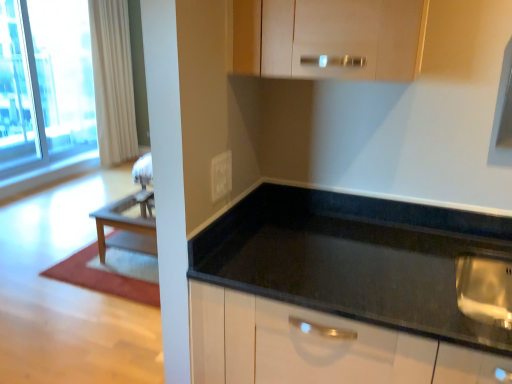
What is the approximate width of black granite countertop at center?

The width of black granite countertop at center is 26.19 inches.

Where is `matte wood cabinet at upper center`? This screenshot has height=384, width=512. matte wood cabinet at upper center is located at coordinates (343, 37).

Can you confirm if transparent glass window at upper left is smaller than white glossy electric outlet at center?

Actually, transparent glass window at upper left might be larger than white glossy electric outlet at center.

Looking at their sizes, would you say transparent glass window at upper left is wider or thinner than white glossy electric outlet at center?

transparent glass window at upper left is wider than white glossy electric outlet at center.

Is transparent glass window at upper left looking in the opposite direction of white glossy electric outlet at center?

No, transparent glass window at upper left is not facing the opposite direction of white glossy electric outlet at center.

From the image's perspective, between transparent glass window at upper left and matte wood cabinet at upper center, who is located below?

matte wood cabinet at upper center.

Is transparent glass window at upper left to the left of matte wood cabinet at upper center from the viewer's perspective?

Yes, transparent glass window at upper left is to the left of matte wood cabinet at upper center.

Measure the distance between transparent glass window at upper left and matte wood cabinet at upper center.

transparent glass window at upper left and matte wood cabinet at upper center are 14.41 feet apart.

Is transparent glass window at upper left with black granite countertop at center?

No.

What's the angular difference between transparent glass window at upper left and black granite countertop at center's facing directions?

The angular difference between transparent glass window at upper left and black granite countertop at center is 91 degrees.

From the image's perspective, relative to black granite countertop at center, is transparent glass window at upper left above or below?

transparent glass window at upper left is above black granite countertop at center.

This screenshot has width=512, height=384. Identify the location of countertop that is under the transparent glass window at upper left (from a real-world perspective). (355, 259).

Which of these two, matte wood cabinet at upper center or white textured curtain at left, is thinner?

With smaller width is white textured curtain at left.

Does matte wood cabinet at upper center contain white textured curtain at left?

No, matte wood cabinet at upper center does not contain white textured curtain at left.

In order to click on curtain that appears above the matte wood cabinet at upper center (from the image's perspective) in this screenshot , I will do `click(113, 81)`.

Is point (226, 176) in front of point (294, 2)?

No.

Is white glossy electric outlet at center placed right next to matte wood cabinet at upper center?

There is a gap between white glossy electric outlet at center and matte wood cabinet at upper center.

Between white glossy electric outlet at center and matte wood cabinet at upper center, which one appears on the left side from the viewer's perspective?

From the viewer's perspective, white glossy electric outlet at center appears more on the left side.

In the scene shown: In terms of width, does white glossy electric outlet at center look wider or thinner when compared to matte wood cabinet at upper center?

Considering their sizes, white glossy electric outlet at center looks slimmer than matte wood cabinet at upper center.

Considering the positions of objects white textured curtain at left and matte wood cabinet at upper center in the image provided, who is more to the right, white textured curtain at left or matte wood cabinet at upper center?

matte wood cabinet at upper center is more to the right.

This screenshot has height=384, width=512. What are the coordinates of `curtain above the matte wood cabinet at upper center (from the image's perspective)` in the screenshot? It's located at (113, 81).

Can you confirm if white textured curtain at left is wider than matte wood cabinet at upper center?

No.

Is white textured curtain at left spatially inside matte wood cabinet at upper center, or outside of it?

The correct answer is: outside.

Is matte wood cabinet at upper center thinner than white glossy electric outlet at center?

No, matte wood cabinet at upper center is not thinner than white glossy electric outlet at center.

Can we say matte wood cabinet at upper center lies outside white glossy electric outlet at center?

matte wood cabinet at upper center lies outside white glossy electric outlet at center's area.

Can you confirm if matte wood cabinet at upper center is positioned to the left of white glossy electric outlet at center?

In fact, matte wood cabinet at upper center is to the right of white glossy electric outlet at center.

You are a GUI agent. You are given a task and a screenshot of the screen. Output one action in this format:
    pyautogui.click(x=<x>, y=<y>)
    Task: Click on the window below the white glossy electric outlet at center (from a real-world perspective)
    
    Given the screenshot: What is the action you would take?
    pyautogui.click(x=44, y=83)

The height and width of the screenshot is (384, 512). I want to click on window on the left of matte wood cabinet at upper center, so click(x=44, y=83).

Which object lies further to the anchor point black granite countertop at center, transparent glass window at upper left or white glossy electric outlet at center?

Among the two, transparent glass window at upper left is located further to black granite countertop at center.

From the picture: Which object lies further to the anchor point black granite countertop at center, white glossy electric outlet at center or transparent glass window at upper left?

transparent glass window at upper left is positioned further to the anchor black granite countertop at center.

Considering their positions, is matte wood cabinet at upper center positioned further to white glossy electric outlet at center than transparent glass window at upper left?

transparent glass window at upper left.

Considering their positions, is white glossy electric outlet at center positioned further to transparent glass window at upper left than black granite countertop at center?

white glossy electric outlet at center.

When comparing their distances from white textured curtain at left, does white glossy electric outlet at center or matte wood cabinet at upper center seem closer?

Based on the image, matte wood cabinet at upper center appears to be nearer to white textured curtain at left.

Based on their spatial positions, is white glossy electric outlet at center or transparent glass window at upper left closer to white textured curtain at left?

transparent glass window at upper left is closer to white textured curtain at left.

Looking at the image, which one is located closer to white glossy electric outlet at center, white textured curtain at left or transparent glass window at upper left?

white textured curtain at left is closer to white glossy electric outlet at center.

Which object lies nearer to the anchor point matte wood cabinet at upper center, transparent glass window at upper left or white textured curtain at left?

white textured curtain at left is closer to matte wood cabinet at upper center.

Identify the location of electric outlet between matte wood cabinet at upper center and white textured curtain at left along the z-axis. (221, 175).

Identify the location of cabinetry between black granite countertop at center and white textured curtain at left along the z-axis. coord(343,37).

I want to click on window located between white glossy electric outlet at center and white textured curtain at left in the depth direction, so click(x=44, y=83).

I want to click on electric outlet between matte wood cabinet at upper center and black granite countertop at center in the up-down direction, so tap(221, 175).